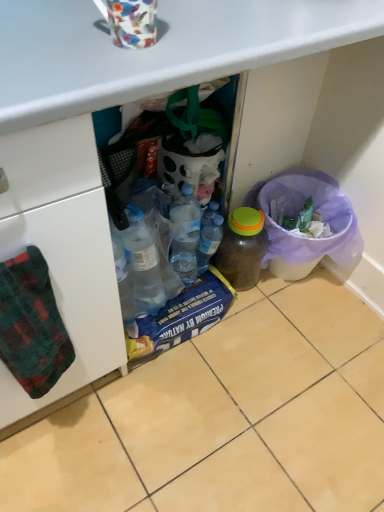
Question: From a real-world perspective, relative to floral-patterned ceramic mug at upper center, is beige tile at lower center vertically above or below?

Choices:
 (A) below
 (B) above

Answer: (A)

Question: Based on their sizes in the image, would you say beige tile at lower center is bigger or smaller than floral-patterned ceramic mug at upper center?

Choices:
 (A) small
 (B) big

Answer: (B)

Question: Which is nearer to the beige tile at lower center?

Choices:
 (A) translucent plastic bottle at center, the 2th bottle viewed from the right
 (B) floral-patterned ceramic mug at upper center
 (C) translucent plastic bottle at center-right, the second bottle viewed from the left
 (D) green plaid towel at left
 (E) translucent plastic bin at lower right

Answer: (C)

Question: Estimate the real-world distances between objects in this image. Which object is closer to the translucent plastic bottle at center, which is the first bottle from left to right?

Choices:
 (A) translucent plastic bin at lower right
 (B) green plaid towel at left
 (C) translucent plastic bottle at center-right, which is the first bottle in right-to-left order
 (D) floral-patterned ceramic mug at upper center
 (E) beige tile at lower center

Answer: (C)